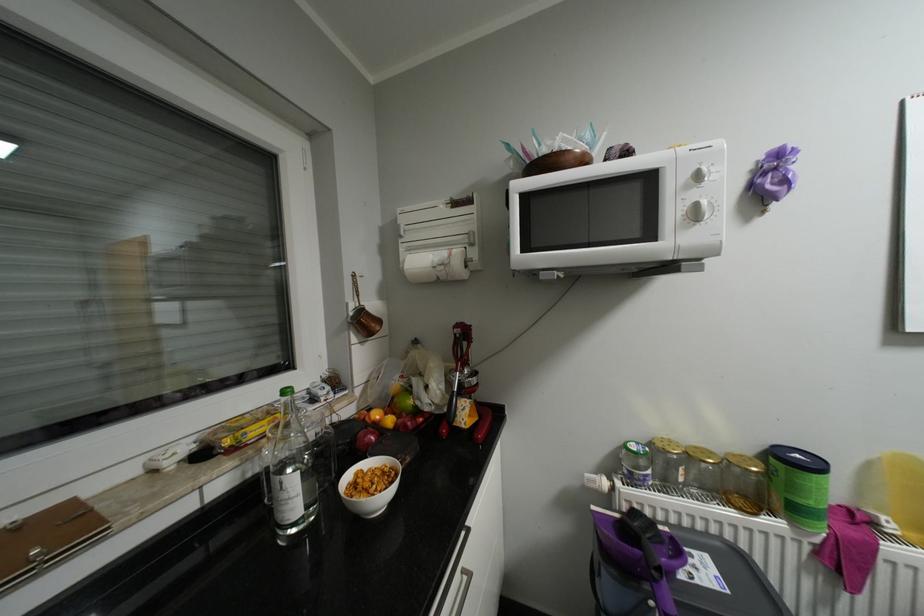
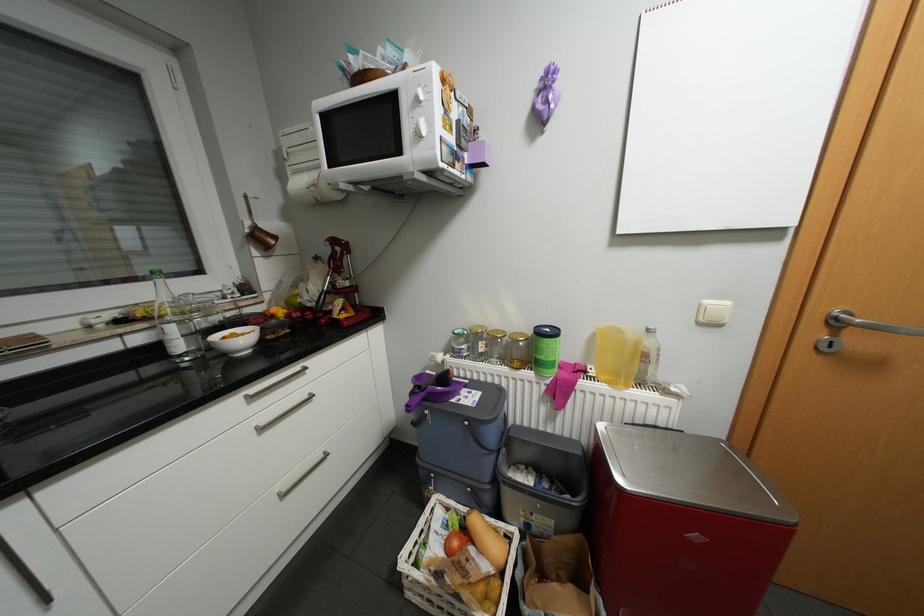
The point at (434, 408) is marked in the first image. Where is the corresponding point in the second image?

(317, 304)